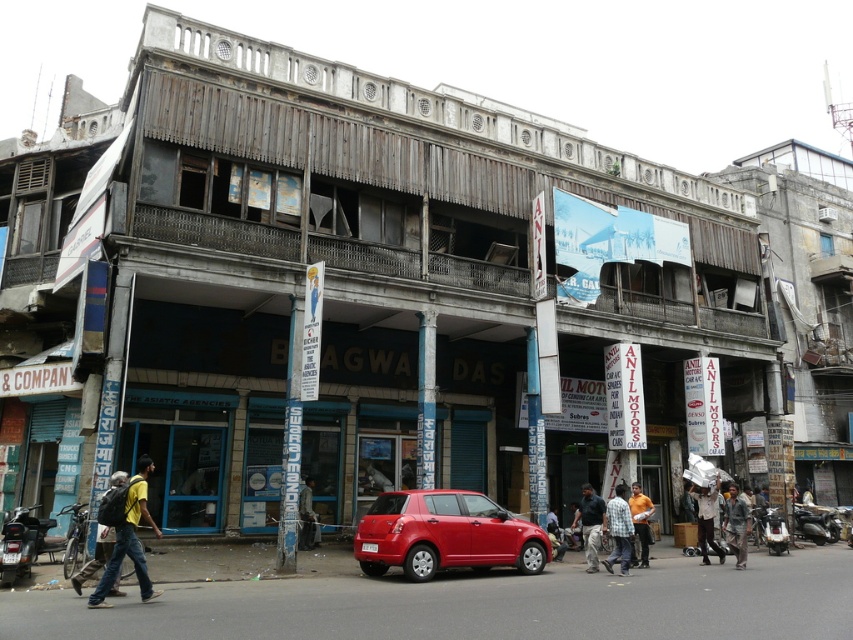
Question: Is yellow t-shirt at lower left further to the viewer compared to orange t-shirt at center?

Choices:
 (A) yes
 (B) no

Answer: (B)

Question: Which of the following is the closest to the observer?

Choices:
 (A) checkered fabric shirt at lower center
 (B) shiny red hatchback at center

Answer: (B)

Question: Among these objects, which one is farthest from the camera?

Choices:
 (A) yellow t-shirt at lower left
 (B) shiny red hatchback at center
 (C) orange t-shirt at center

Answer: (C)

Question: Which is farther from the shiny red hatchback at center?

Choices:
 (A) yellow t-shirt at lower left
 (B) checkered fabric shirt at lower center
 (C) dark blue jeans at center

Answer: (A)

Question: Does white matte plastic bag at center have a larger size compared to dark gray fabric jacket at center?

Choices:
 (A) yes
 (B) no

Answer: (A)

Question: Can you confirm if shiny red hatchback at center is positioned below dark gray fabric jacket at center?

Choices:
 (A) yes
 (B) no

Answer: (B)